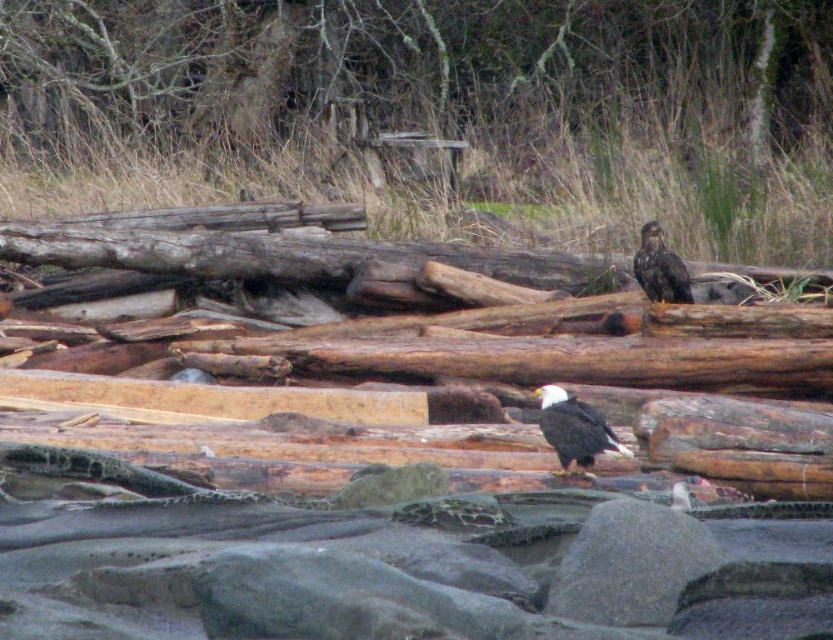
Question: Which point appears farthest from the camera in this image?

Choices:
 (A) (537, 392)
 (B) (580, 573)
 (C) (652, 230)

Answer: (C)

Question: Does white-feathered bald eagle at center appear under dark brown feathers at upper right?

Choices:
 (A) yes
 (B) no

Answer: (A)

Question: Which object is farther from the camera taking this photo?

Choices:
 (A) dark brown feathers at upper right
 (B) gray rough rock at lower center
 (C) brown rough wood at upper center
 (D) white-feathered bald eagle at center

Answer: (C)

Question: Is gray rough rock at lower center to the left of white-feathered bald eagle at center from the viewer's perspective?

Choices:
 (A) yes
 (B) no

Answer: (A)

Question: Is brown rough wood at upper center thinner than dark brown feathers at upper right?

Choices:
 (A) no
 (B) yes

Answer: (A)

Question: Based on their relative distances, which object is nearer to the white-feathered bald eagle at center?

Choices:
 (A) brown rough wood at upper center
 (B) dark brown feathers at upper right

Answer: (B)